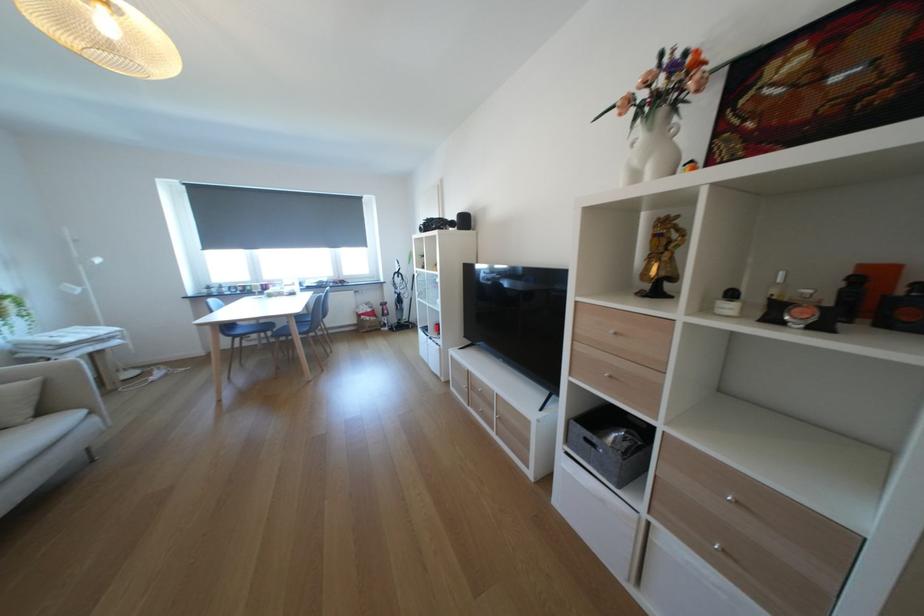
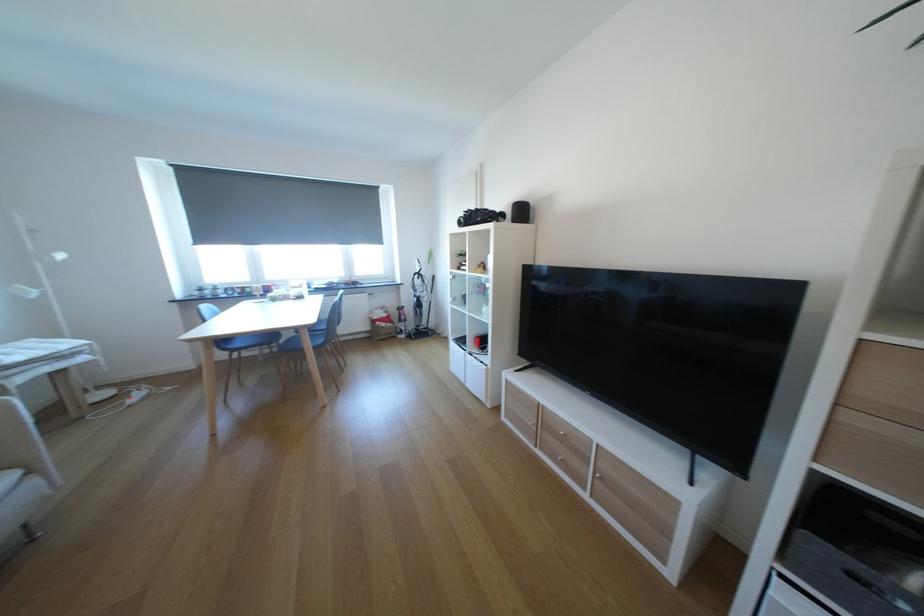
In the second image, find the point that corresponds to point (310, 318) in the first image.

(322, 330)